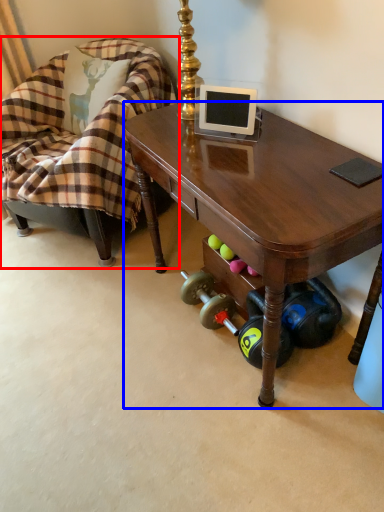
Question: Among these objects, which one is nearest to the camera, chair (highlighted by a red box) or desk (highlighted by a blue box)?

Choices:
 (A) chair
 (B) desk

Answer: (B)